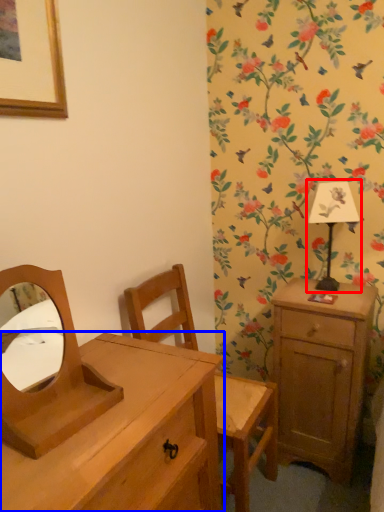
Question: Among these objects, which one is nearest to the camera, bedside lamp (highlighted by a red box) or chest of drawers (highlighted by a blue box)?

Choices:
 (A) bedside lamp
 (B) chest of drawers

Answer: (B)